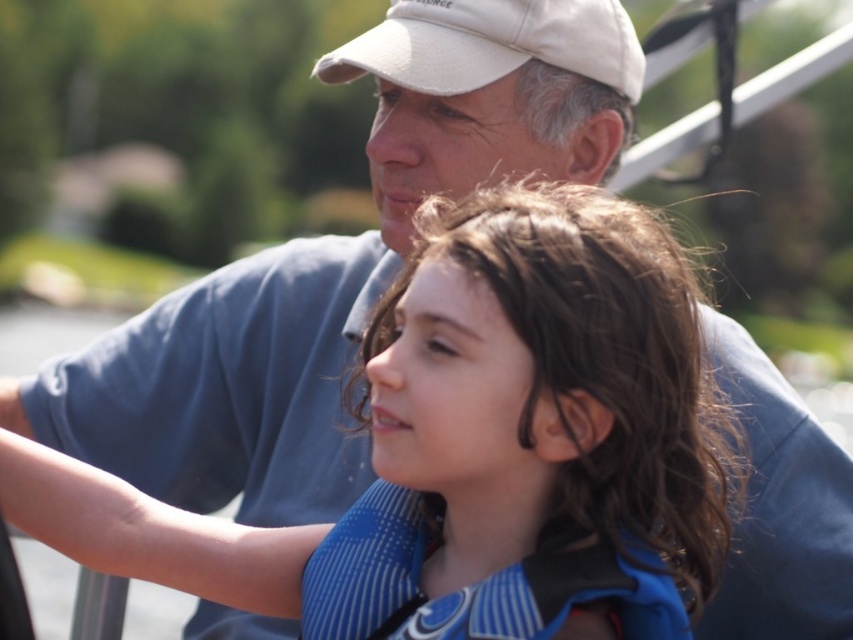
Question: Can you confirm if wet hair at center is positioned above white matte baseball cap at upper center?

Choices:
 (A) yes
 (B) no

Answer: (B)

Question: Which of the following is the farthest from the observer?

Choices:
 (A) white matte baseball cap at upper center
 (B) wet hair at center

Answer: (A)

Question: Is the position of wet hair at center less distant than that of white matte baseball cap at upper center?

Choices:
 (A) no
 (B) yes

Answer: (B)

Question: Observing the image, what is the correct spatial positioning of wet hair at center in reference to white matte baseball cap at upper center?

Choices:
 (A) above
 (B) below

Answer: (B)

Question: Which point is closer to the camera taking this photo?

Choices:
 (A) (460, 90)
 (B) (477, 440)

Answer: (B)